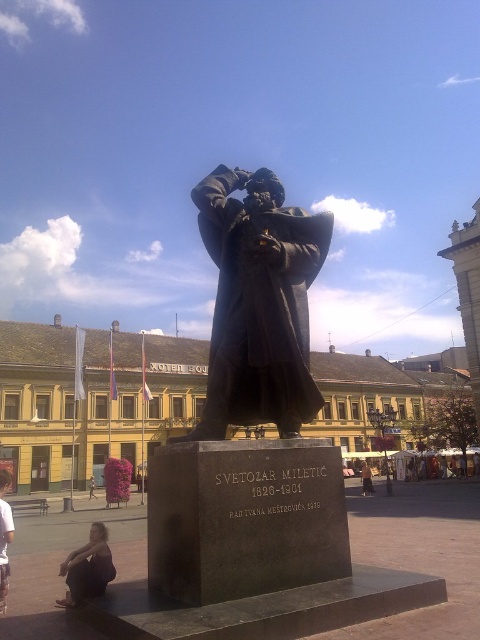
Question: Among these objects, which one is farthest from the camera?

Choices:
 (A) bronze statue at center
 (B) dark hair human at lower left

Answer: (A)

Question: Which point is farther to the camera?

Choices:
 (A) (91, 492)
 (B) (268, 406)

Answer: (A)

Question: Which point appears closest to the camera in this image?

Choices:
 (A) click(x=13, y=445)
 (B) click(x=365, y=492)
 (C) click(x=244, y=353)

Answer: (C)

Question: Does bronze statue at center have a greater width compared to dark hair human at lower left?

Choices:
 (A) yes
 (B) no

Answer: (A)

Question: Does bronze statue at center have a lesser width compared to dark brown leather jacket at lower left?

Choices:
 (A) no
 (B) yes

Answer: (A)

Question: Does yellow painted building at center have a lesser width compared to dark hair human at lower left?

Choices:
 (A) yes
 (B) no

Answer: (B)